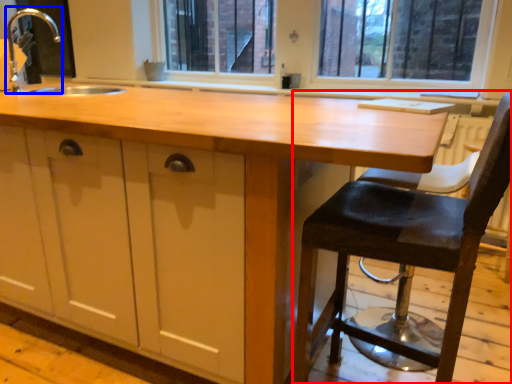
Question: Which point is closer to the camera, chair (highlighted by a red box) or faucet (highlighted by a blue box)?

Choices:
 (A) chair
 (B) faucet

Answer: (A)